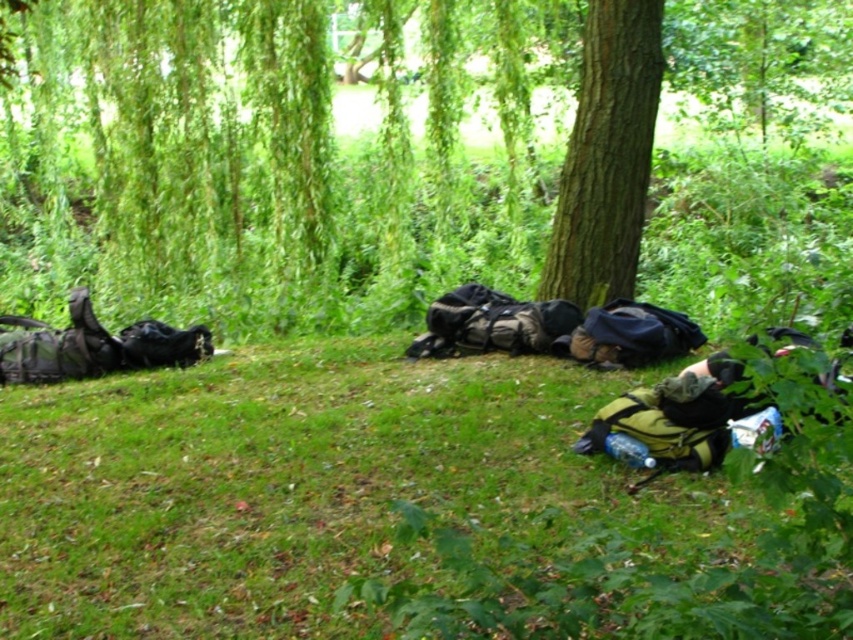
You are standing in a park and see the green grass at lower left and the brown rough bark tree at center. Which object is positioned to the left of the other?

The green grass at lower left is to the left of the brown rough bark tree at center.

You are standing in the park and see the green grass at lower left and the brown rough bark tree at center. Which object is closer to the ground?

The green grass at lower left is closer to the ground because it is below the brown rough bark tree at center.

You are planning to set up a tent in this camping area. The tent requires a flat space of at least 2 meters between the green grass at lower left and the brown rough bark tree at center. Is the available space sufficient?

The distance between the green grass at lower left and the brown rough bark tree at center is 2.34 meters, which is more than the required 2 meters. Therefore, the available space is sufficient for setting up the tent.